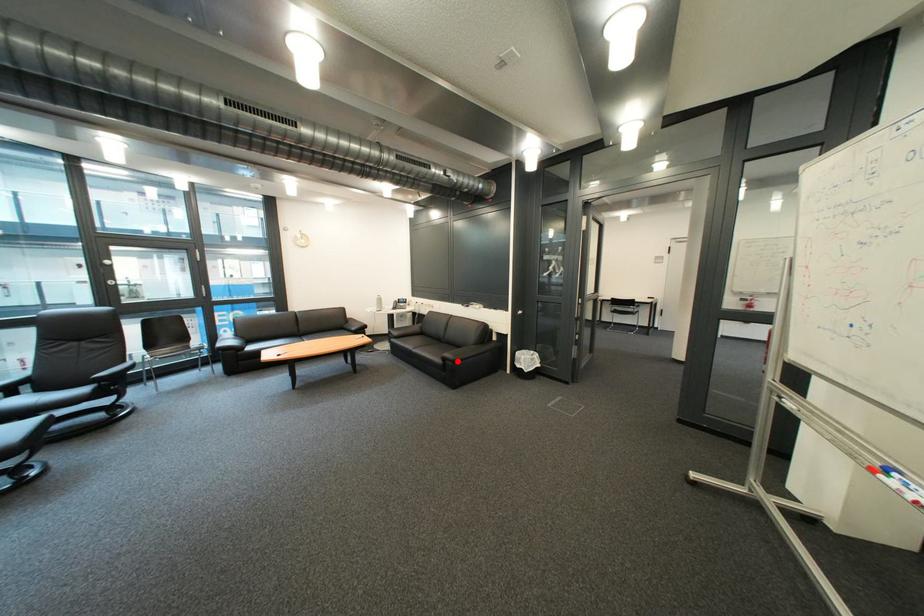
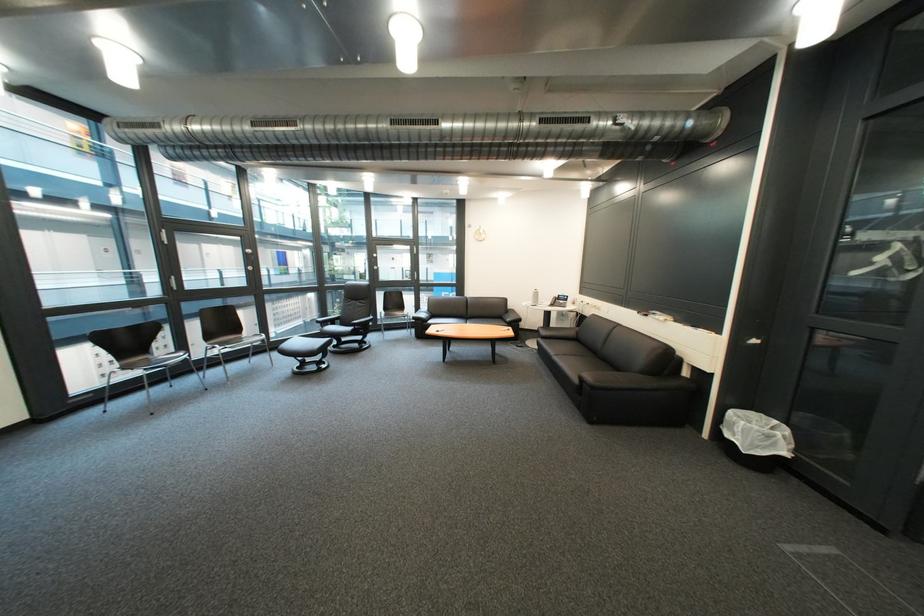
Where in the second image is the point corresponding to the highlighted location from the first image?

(594, 381)